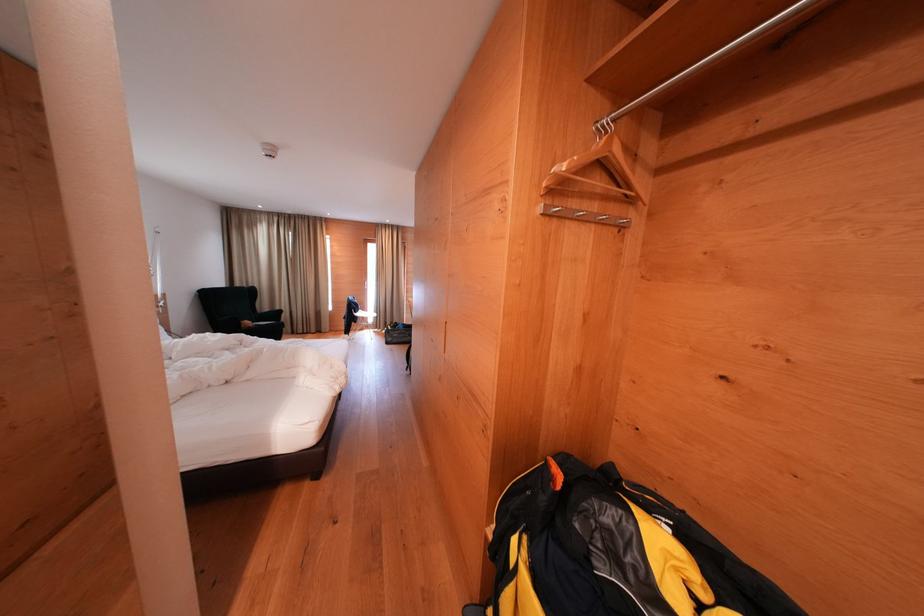
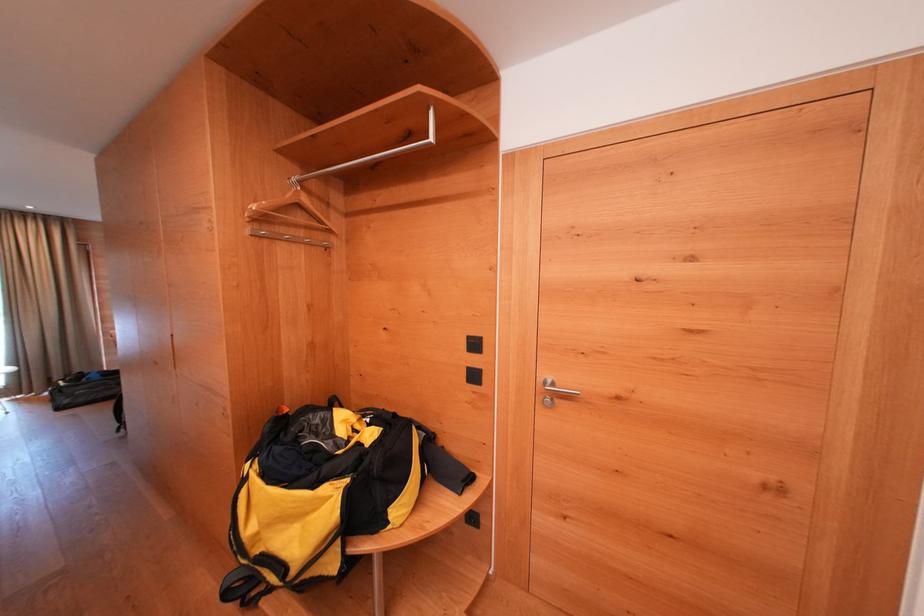
Question: The camera is either moving clockwise (left) or counter-clockwise (right) around the object. The first image is from the beginning of the video and the second image is from the end. Is the camera moving left or right when shooting the video?

Choices:
 (A) Left
 (B) Right

Answer: (A)